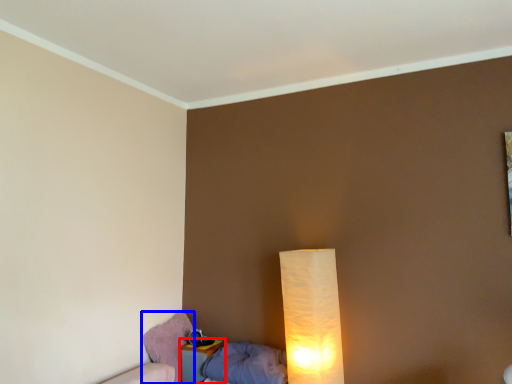
Question: Which object is further to the camera taking this photo, nightstand (highlighted by a red box) or swivel chair (highlighted by a blue box)?

Choices:
 (A) nightstand
 (B) swivel chair

Answer: (B)